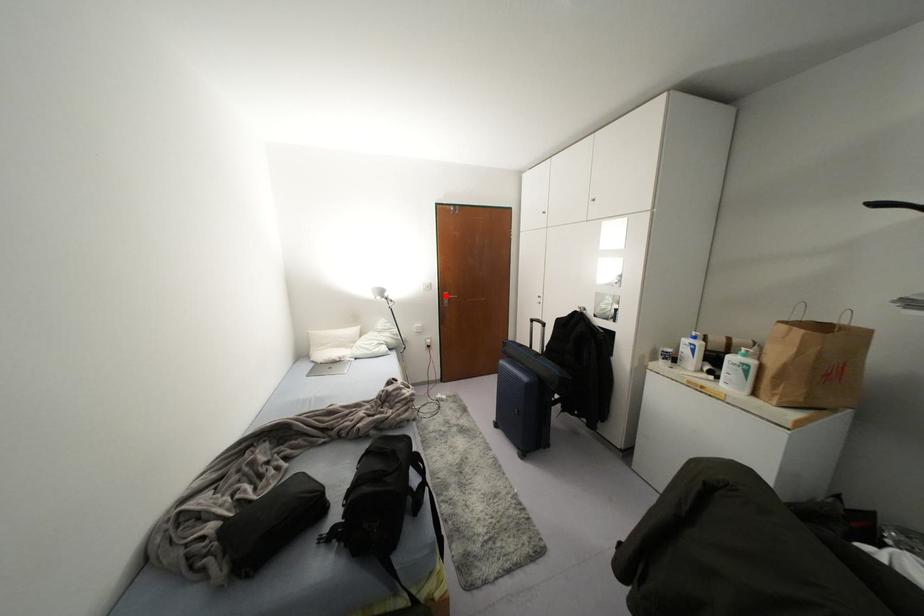
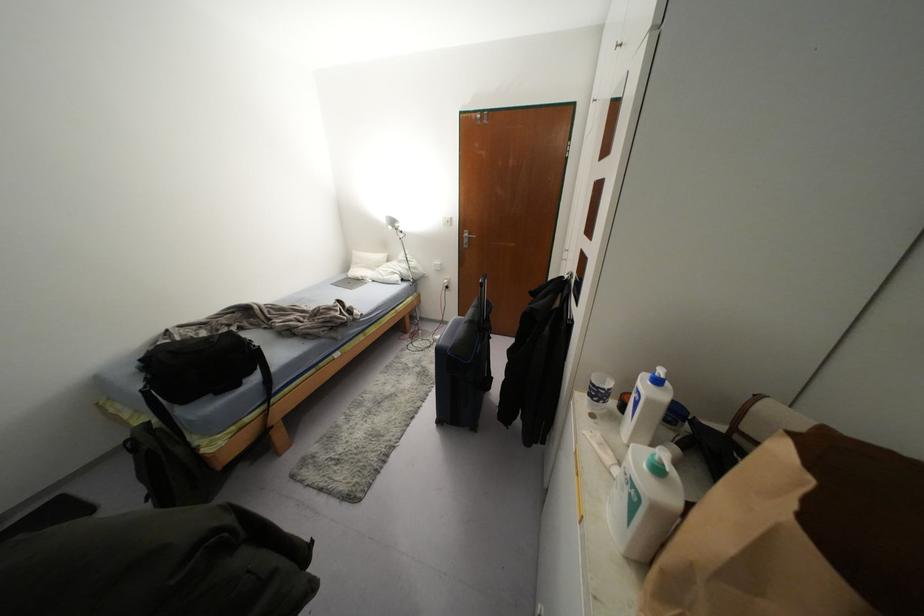
Where in the second image is the point corresponding to the highlighted location from the first image?

(465, 233)